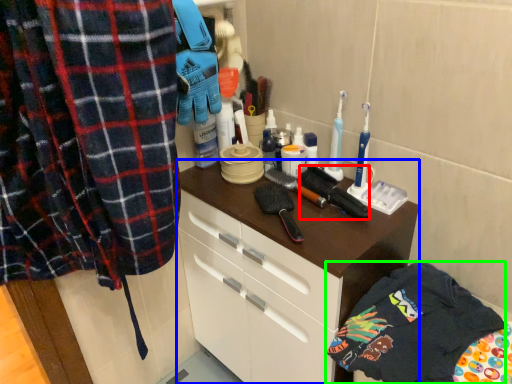
Question: Based on their relative distances, which object is farther from brush (highlighted by a red box)? Choose from cabinetry (highlighted by a blue box) and clothing (highlighted by a green box).

Choices:
 (A) cabinetry
 (B) clothing

Answer: (B)